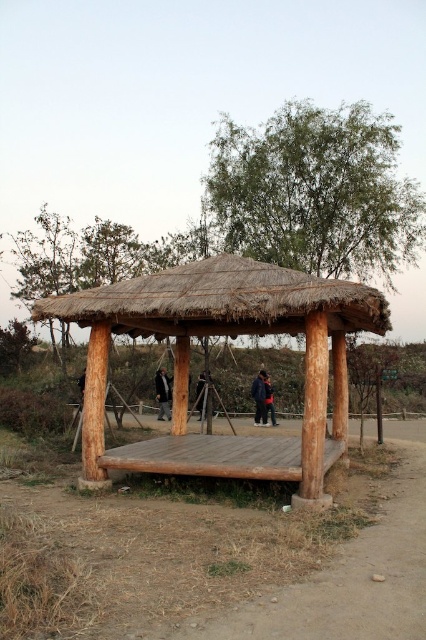
Looking at this image, does brown dirt field at lower center come behind dark brown leather jacket at center?

No.

Locate an element on the screen. brown dirt field at lower center is located at coordinates (247, 563).

Is thatched straw roof at center shorter than dark blue jeans at center?

Indeed, thatched straw roof at center has a lesser height compared to dark blue jeans at center.

Does thatched straw roof at center have a greater width compared to dark blue jeans at center?

Indeed, thatched straw roof at center has a greater width compared to dark blue jeans at center.

Does point (86, 307) lie in front of point (261, 403)?

Yes, point (86, 307) is closer to viewer.

This screenshot has height=640, width=426. Find the location of `thatched straw roof at center`. thatched straw roof at center is located at coordinates (221, 301).

Who is positioned more to the right, thatched straw roof at center or dark brown leather jacket at center?

thatched straw roof at center is more to the right.

Does point (368, 291) come in front of point (164, 410)?

Yes, point (368, 291) is closer to viewer.

Where is `thatched straw roof at center`? The width and height of the screenshot is (426, 640). thatched straw roof at center is located at coordinates (221, 301).